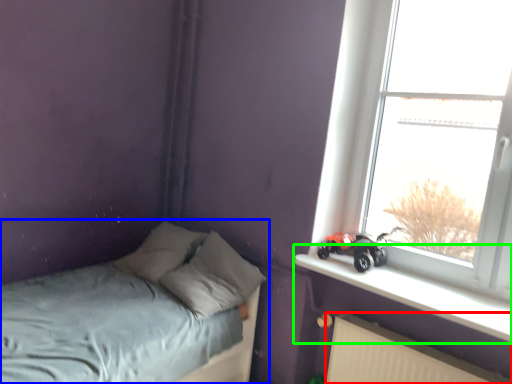
Question: Which object is positioned closest to radiator (highlighted by a red box)? Select from bed (highlighted by a blue box) and window sill (highlighted by a green box).

Choices:
 (A) bed
 (B) window sill

Answer: (B)